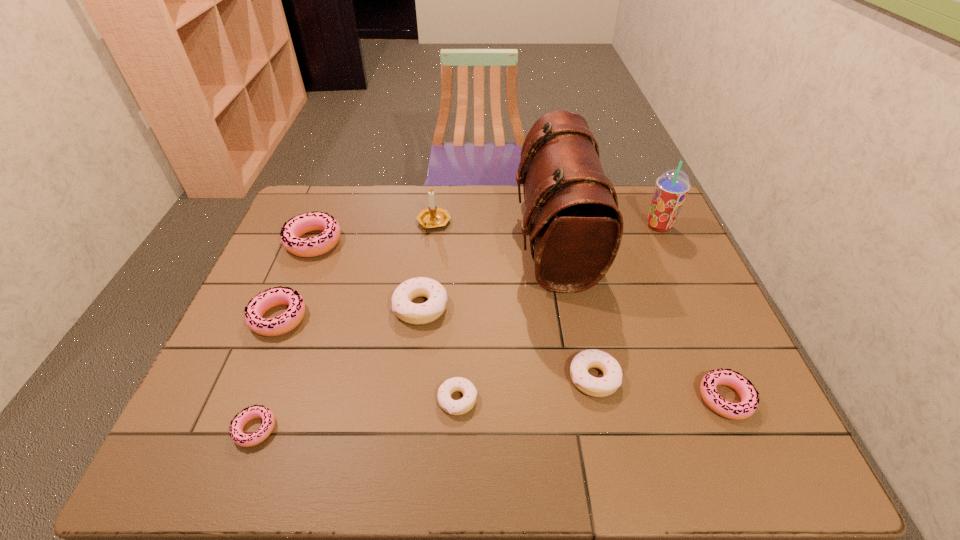
I want to click on doughnut at the far edge, so click(x=315, y=221).

What are the coordinates of `object that is at the near edge` in the screenshot? It's located at (256, 411).

You are a GUI agent. You are given a task and a screenshot of the screen. Output one action in this format:
    pyautogui.click(x=<x>, y=<y>)
    Task: Click on the smoothie that is at the right edge
    Image resolution: width=960 pixels, height=540 pixels.
    Given the screenshot: What is the action you would take?
    pyautogui.click(x=672, y=187)

You are a GUI agent. You are given a task and a screenshot of the screen. Output one action in this format:
    pyautogui.click(x=<x>, y=<y>)
    Task: Click on the doughnut at the right edge
    The image size is (960, 540).
    Given the screenshot: What is the action you would take?
    pyautogui.click(x=749, y=402)

Locate an element on the screen. This screenshot has height=540, width=960. object that is at the far left corner is located at coordinates (x=315, y=221).

The image size is (960, 540). Identify the location of object that is at the near left corner. (256, 411).

Image resolution: width=960 pixels, height=540 pixels. Find the location of `object that is positioned at the far right corner`. object that is positioned at the far right corner is located at coordinates (672, 187).

This screenshot has width=960, height=540. In order to click on vacant space at the far edge in this screenshot , I will do `click(498, 212)`.

You are a GUI agent. You are given a task and a screenshot of the screen. Output one action in this format:
    pyautogui.click(x=<x>, y=<y>)
    Task: Click on the free space at the near edge
    This screenshot has height=540, width=960.
    Given the screenshot: What is the action you would take?
    pyautogui.click(x=310, y=465)

The image size is (960, 540). In order to click on free space at the left edge of the desktop in this screenshot , I will do `click(315, 264)`.